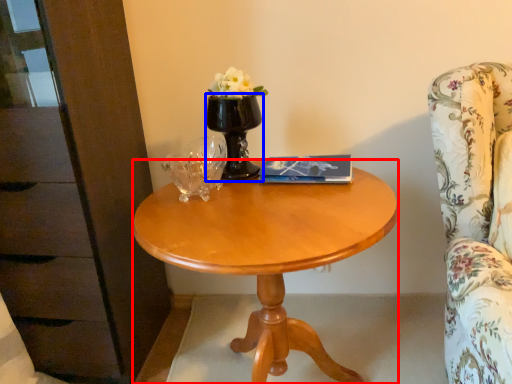
Question: Which object is further to the camera taking this photo, desk (highlighted by a red box) or vase (highlighted by a blue box)?

Choices:
 (A) desk
 (B) vase

Answer: (B)